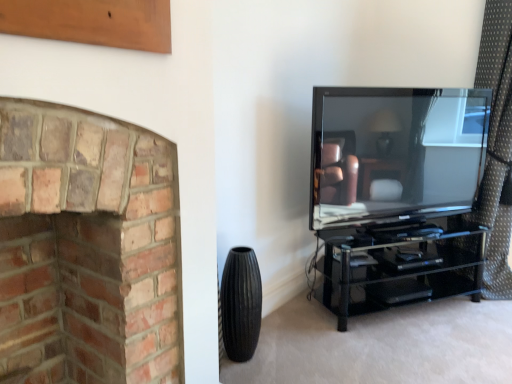
Locate an element on the screen. This screenshot has width=512, height=384. free spot to the right of black ribbed vase at lower center is located at coordinates (281, 360).